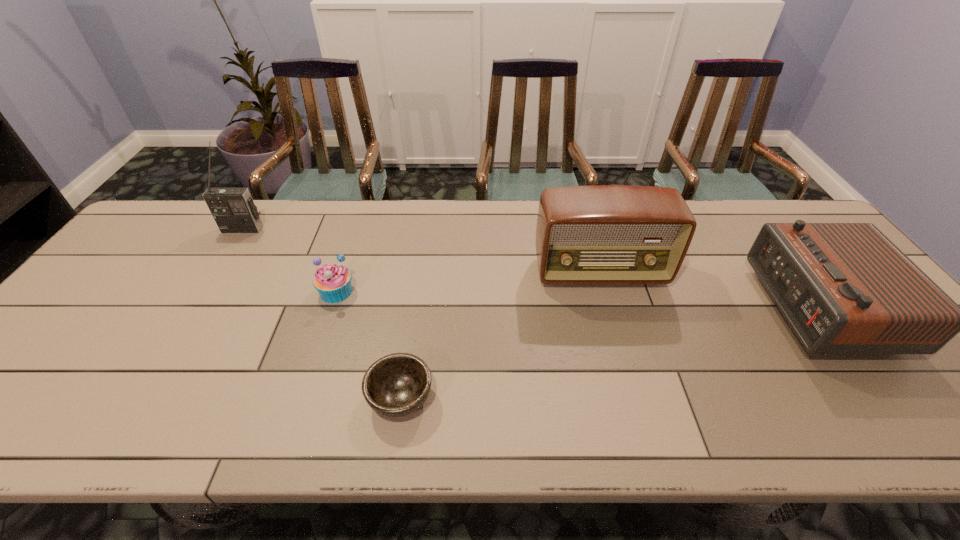
At what (x,y) coordinates should I click in order to perform the action: click on the farthest radio receiver. Please return your answer as a coordinate pair (x, y). The height and width of the screenshot is (540, 960). Looking at the image, I should click on (233, 209).

Identify the location of the farthest object. (233, 209).

At what (x,y) coordinates should I click in order to perform the action: click on the fourth shortest object. Please return your answer as a coordinate pair (x, y). Looking at the image, I should click on (603, 234).

Identify the location of the second radio receiver from left to right. The height and width of the screenshot is (540, 960). [603, 234].

Locate an element on the screen. The image size is (960, 540). the shortest radio receiver is located at coordinates (844, 288).

Find the location of `the rightmost object`. the rightmost object is located at coordinates (844, 288).

Find the location of a particular element. This screenshot has width=960, height=540. muffin is located at coordinates (333, 282).

Where is `the fourth object from right to left`? the fourth object from right to left is located at coordinates (333, 282).

Locate an element on the screen. bowl is located at coordinates (396, 385).

This screenshot has width=960, height=540. What are the coordinates of `the nearest object` in the screenshot? It's located at (396, 385).